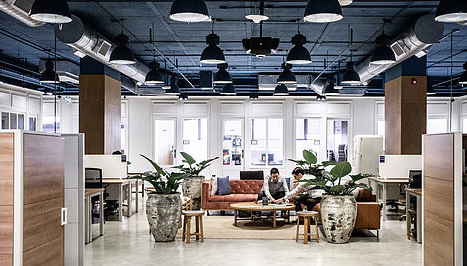
This screenshot has height=266, width=467. I want to click on 1 pillow, so click(x=221, y=188).